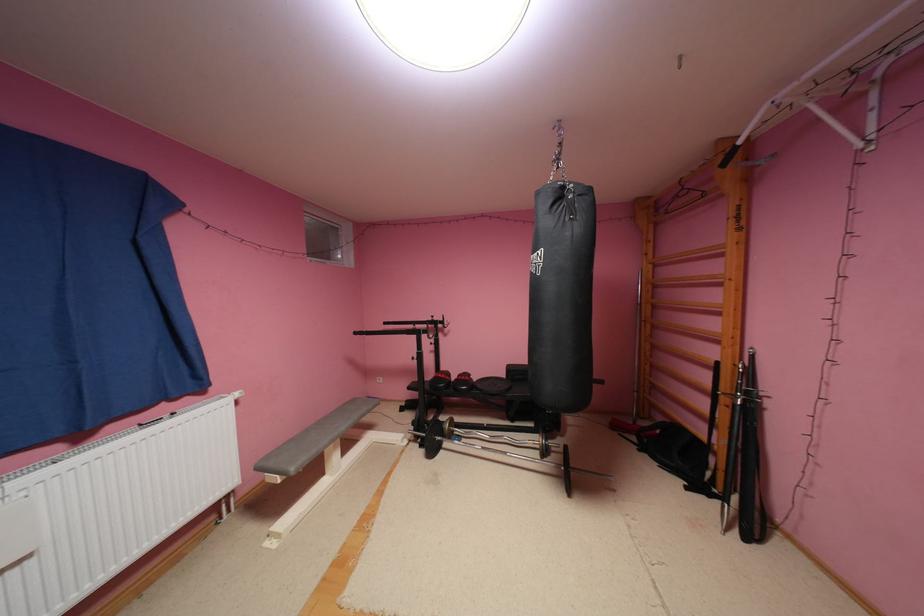
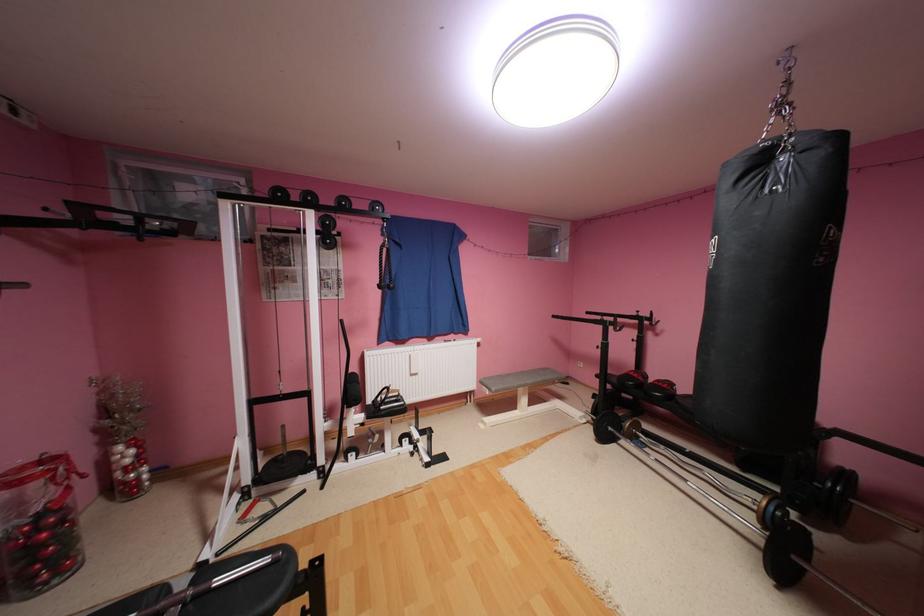
In the second image, find the point that corresponds to pixel 578 496 in the first image.

(787, 588)